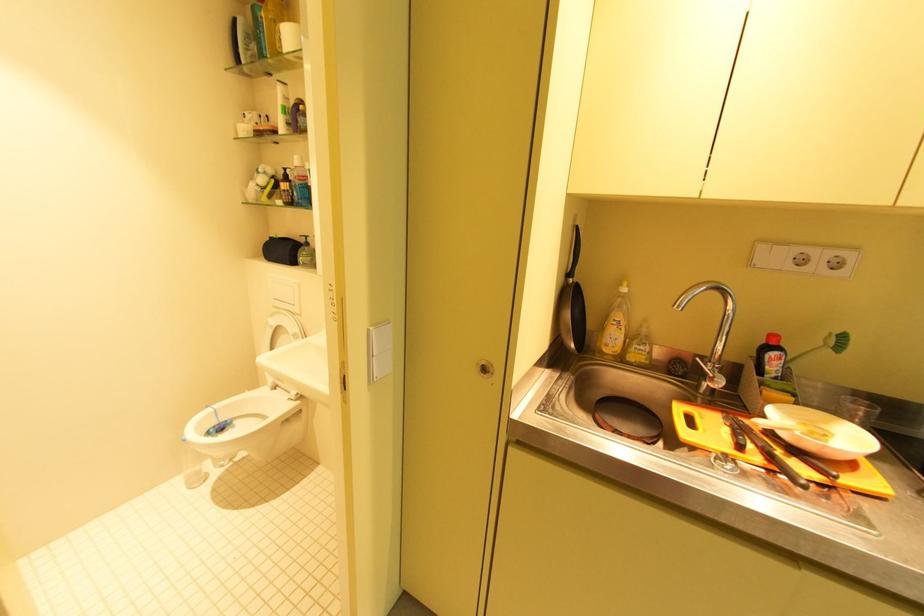
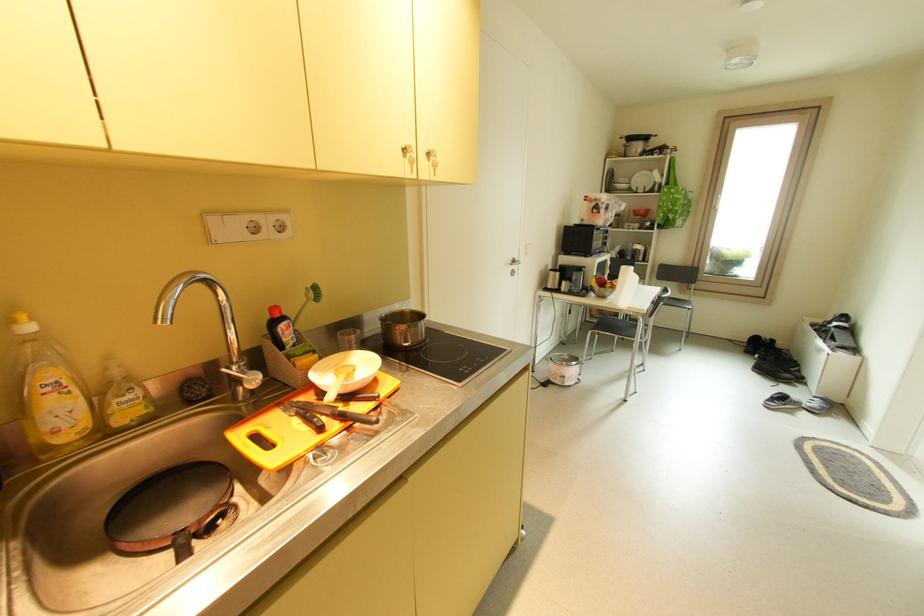
Locate, in the second image, the point that corresponds to (775,456) in the first image.

(347, 418)